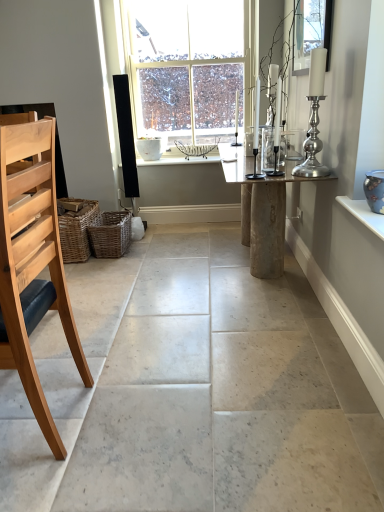
At what (x,y) coordinates should I click in order to perform the action: click on free spot in front of rustic wood table at center. Please return your answer as a coordinate pair (x, y). This screenshot has height=512, width=384. Looking at the image, I should click on (218, 340).